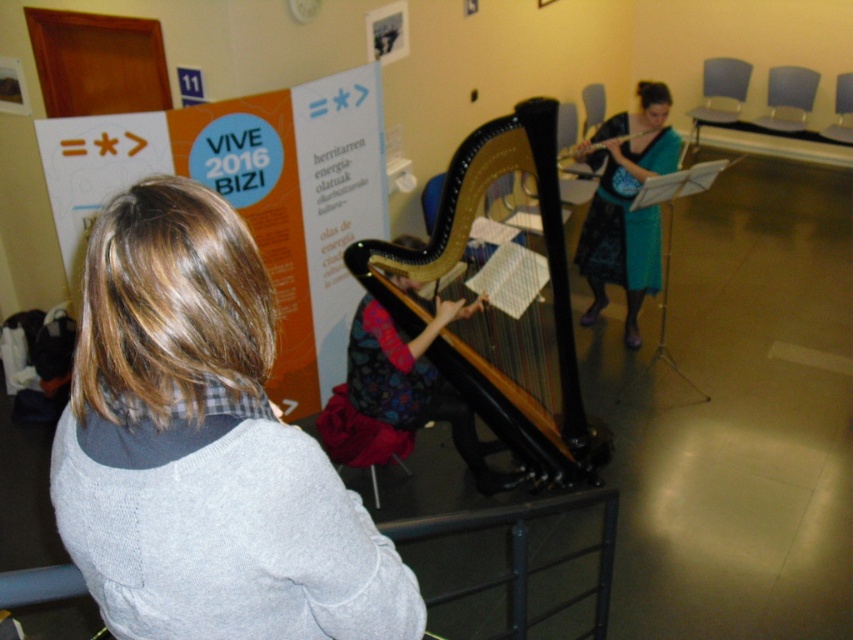
Question: Estimate the real-world distances between objects in this image. Which object is closer to the wooden flute at upper right?

Choices:
 (A) wooden harp at center
 (B) teal fabric skirt at center

Answer: (B)

Question: Which object appears closest to the camera in this image?

Choices:
 (A) wooden harp at center
 (B) teal fabric skirt at center
 (C) wooden flute at upper right

Answer: (A)

Question: Does gray knitted sweater at center have a smaller size compared to teal fabric skirt at center?

Choices:
 (A) yes
 (B) no

Answer: (A)

Question: Does wooden harp at center lie behind wooden flute at upper right?

Choices:
 (A) no
 (B) yes

Answer: (A)

Question: Which point appears closest to the camera in this image?

Choices:
 (A) (579, 148)
 (B) (587, 275)

Answer: (A)

Question: Can you confirm if gray knitted sweater at center is positioned below wooden flute at upper right?

Choices:
 (A) no
 (B) yes

Answer: (B)